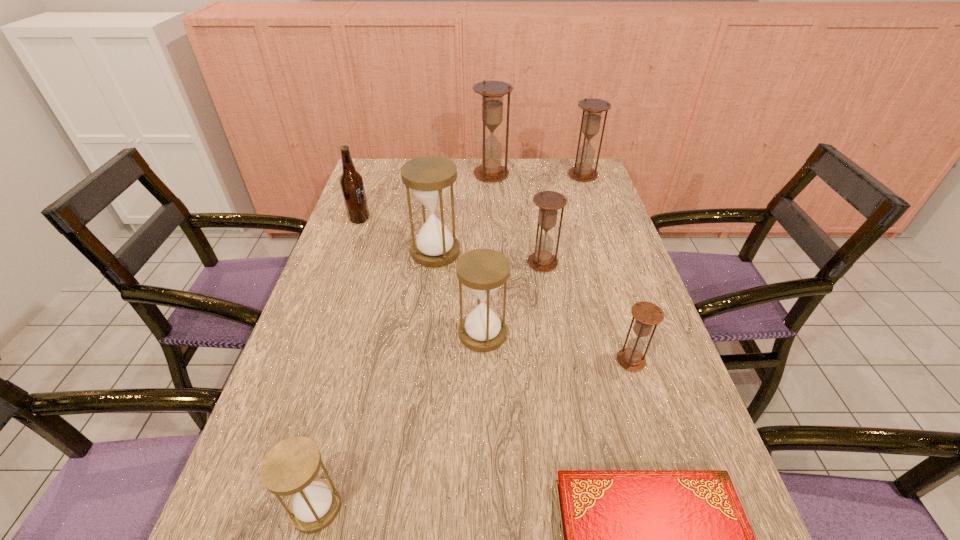
You are a GUI agent. You are given a task and a screenshot of the screen. Output one action in this format:
    pyautogui.click(x=<x>, y=<y>)
    Task: Click on the vacant space that's between the leftmost hourglass and the third farthest brown hourglass
    
    Given the screenshot: What is the action you would take?
    pyautogui.click(x=429, y=385)

Image resolution: width=960 pixels, height=540 pixels. Identify the location of unoccupied area between the second object from left to right and the third brown hourglass from right to left. (429, 385).

Locate an element on the screen. free space between the second nearest brown hourglass and the smallest brown hourglass is located at coordinates (587, 312).

Find the location of `free space between the leftmost object and the second biggest brown hourglass`. free space between the leftmost object and the second biggest brown hourglass is located at coordinates (471, 197).

What are the coordinates of `empty space between the leftmost white hourglass and the smallest brown hourglass` in the screenshot? It's located at (473, 434).

The width and height of the screenshot is (960, 540). I want to click on blank region between the nearest brown hourglass and the sixth hourglass from right to left, so pos(533,306).

You are a GUI agent. You are given a task and a screenshot of the screen. Output one action in this format:
    pyautogui.click(x=<x>, y=<y>)
    Task: Click on the object that stands as the fourth closest to the tallest object
    The height and width of the screenshot is (540, 960).
    Given the screenshot: What is the action you would take?
    pyautogui.click(x=549, y=202)

Select which object is the fourth closest to the second biggest brown hourglass. Please provide its 2D coordinates. Your answer should be formatted as a tuple, i.e. [(x, y)], where the tuple contains the x and y coordinates of a point satisfying the conditions above.

[(483, 271)]

Select which hourglass is the sixth closest to the sixth hourglass from right to left. Please provide its 2D coordinates. Your answer should be formatted as a tuple, i.e. [(x, y)], where the tuple contains the x and y coordinates of a point satisfying the conditions above.

[(290, 467)]

At what (x,y) coordinates should I click in order to perform the action: click on hourglass that is the fourth closest one to the hardback book. Please return your answer as a coordinate pair (x, y). This screenshot has width=960, height=540. Looking at the image, I should click on (549, 202).